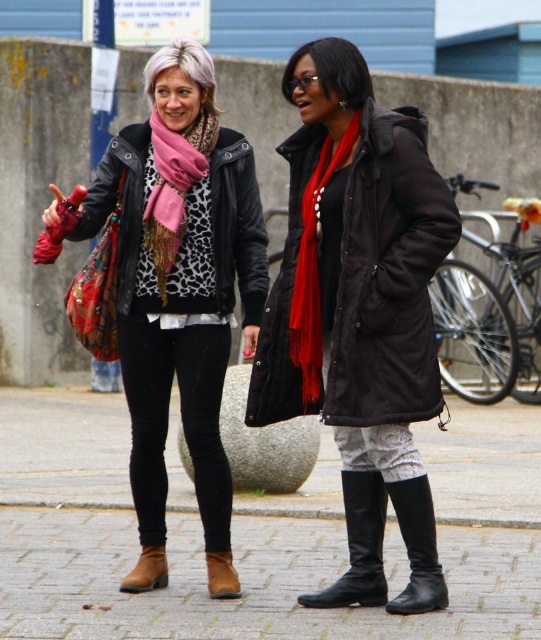
Is matte black coat at center positioned at the back of leather jacket at center?

No, it is not.

Is matte black coat at center positioned before leather jacket at center?

Yes, matte black coat at center is closer to the viewer.

Is point (430, 413) in front of point (243, 212)?

Yes, it is.

The height and width of the screenshot is (640, 541). I want to click on matte black coat at center, so click(x=387, y=276).

Between brick pavement at center and leather jacket at center, which one appears on the left side from the viewer's perspective?

leather jacket at center is more to the left.

Is brick pavement at center below leather jacket at center?

Correct, brick pavement at center is located below leather jacket at center.

Is point (533, 488) more distant than point (138, 196)?

Yes, point (533, 488) is farther from viewer.

The image size is (541, 640). What are the coordinates of `brick pavement at center` in the screenshot? It's located at point(252,531).

Which is more to the left, leather jacket at center or leather boot at lower left?

Positioned to the left is leather boot at lower left.

Find the location of a particular element. leather jacket at center is located at coordinates (237, 225).